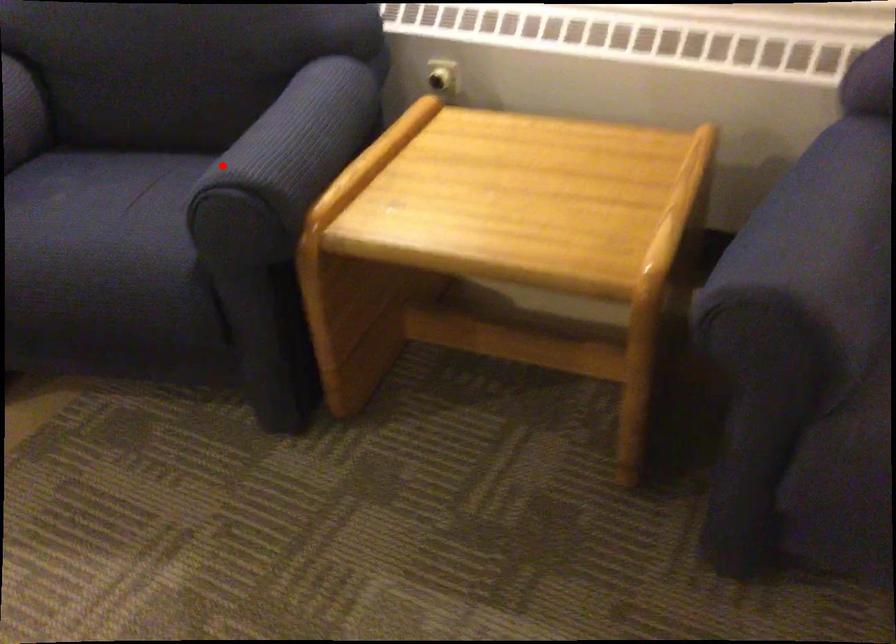
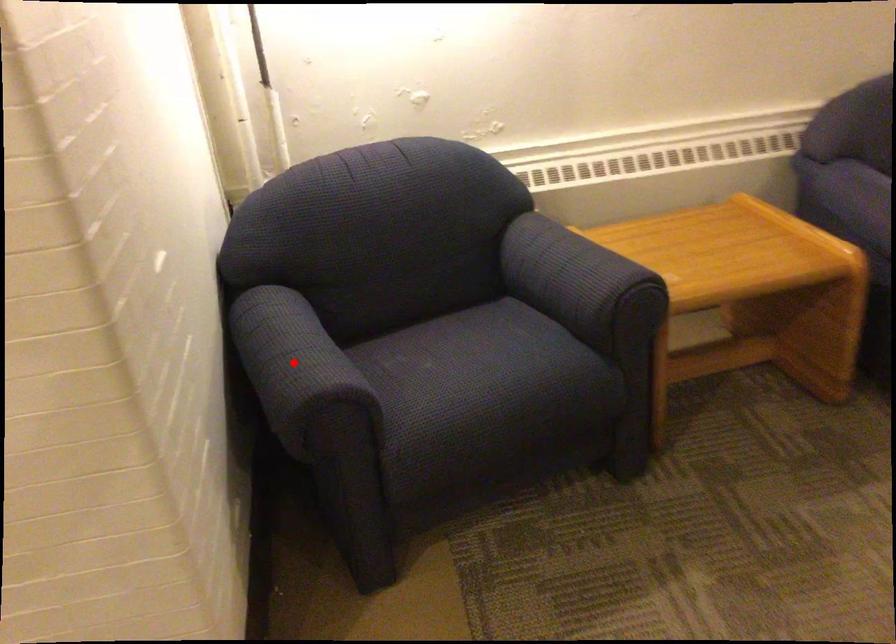
I am providing you with two images of the same scene from different viewpoints. A red point is marked on the first image and another point is marked on the second image. Is the marked point in image1 the same physical position as the marked point in image2?

No